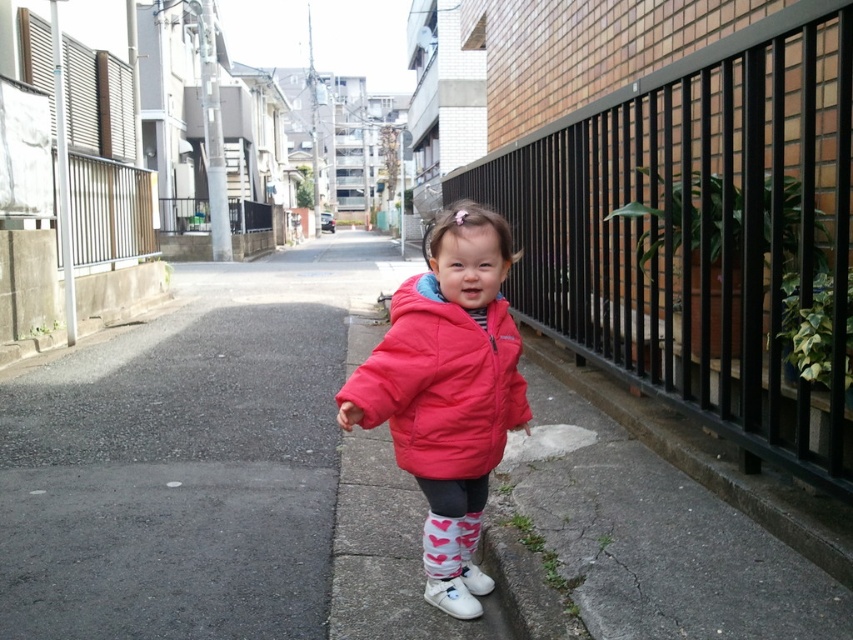
Question: Which point is farther to the camera?

Choices:
 (A) (175, 484)
 (B) (807, 481)
 (C) (480, 326)
 (D) (350, 422)

Answer: (A)

Question: Considering the real-world distances, which object is farthest from the white fabric shoe at lower center?

Choices:
 (A) white matte shoe at lower center
 (B) gray asphalt pavement at center
 (C) matte pink puffer jacket at center

Answer: (B)

Question: In this image, where is black metal fence at right located relative to matte pink jacket at center?

Choices:
 (A) above
 (B) below

Answer: (A)

Question: Which point is farther to the camera?

Choices:
 (A) (434, 580)
 (B) (172, 467)

Answer: (B)

Question: Does black metal fence at right come behind gray concrete curb at lower right?

Choices:
 (A) no
 (B) yes

Answer: (A)

Question: Does matte pink puffer jacket at center have a smaller size compared to gray concrete curb at lower right?

Choices:
 (A) yes
 (B) no

Answer: (A)